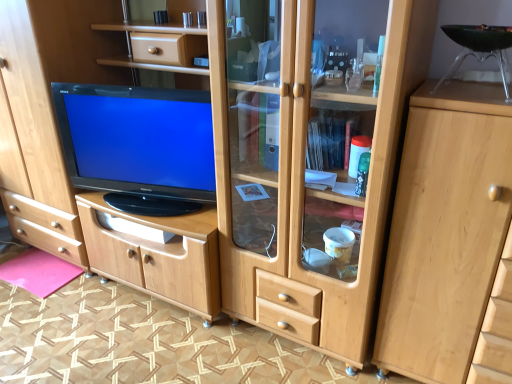
Question: From a real-world perspective, is pink felt mat at lower left above or below light wood cabinet at right?

Choices:
 (A) above
 (B) below

Answer: (B)

Question: Looking at their shapes, would you say pink felt mat at lower left is wider or thinner than light wood cabinet at right?

Choices:
 (A) thin
 (B) wide

Answer: (A)

Question: Estimate the real-world distances between objects in this image. Which object is farther from the light wood cabinet at right?

Choices:
 (A) pink felt mat at lower left
 (B) black glossy television at center

Answer: (A)

Question: Estimate the real-world distances between objects in this image. Which object is closer to the light wood cabinet at right?

Choices:
 (A) pink felt mat at lower left
 (B) black glossy television at center

Answer: (B)